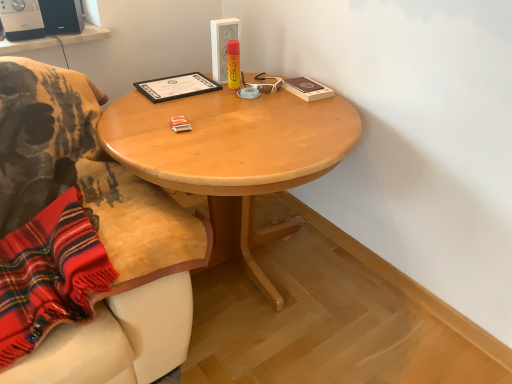
Question: Is black plastic speaker at upper left, which is counted as the second loudspeaker, starting from the right, wider or thinner than black matte certificate at upper center?

Choices:
 (A) wide
 (B) thin

Answer: (A)

Question: Is black plastic speaker at upper left, the 1th loudspeaker from the left, to the left or to the right of black matte certificate at upper center in the image?

Choices:
 (A) left
 (B) right

Answer: (A)

Question: Based on their relative distances, which object is farther from the light wood table at center?

Choices:
 (A) black matte certificate at upper center
 (B) matte black speaker at upper left, the 1th loudspeaker from the right
 (C) black plastic speaker at upper left, which is counted as the second loudspeaker, starting from the right

Answer: (C)

Question: Estimate the real-world distances between objects in this image. Which object is farther from the matte black speaker at upper left, the 1th loudspeaker from the right?

Choices:
 (A) light wood table at center
 (B) black plastic speaker at upper left, which is counted as the second loudspeaker, starting from the right
 (C) black matte certificate at upper center

Answer: (A)